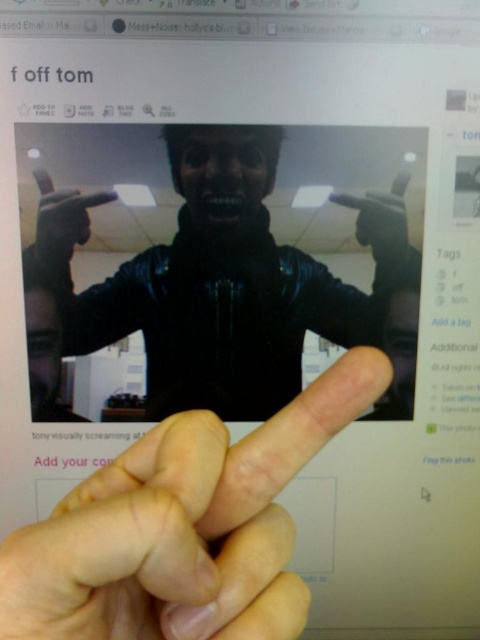
You are looking at the computer screen and see two points marked on the image. Which point is closer to you, point (396, 259) or point (374, 368)?

Point (396, 259) is closer to you because it is further to the viewer than point (374, 368).

What is the position of the black leather jacket at center in the coordinate system provided?

The black leather jacket at center is located at point (230, 284).

You are a photographer who wants to take a picture of the black leather jacket at center without the camera appearing in the shot. The camera is 21.24 inches away from the jacket. If your camera has a 12 inch wide lens, can you position it so that it doesn

The black leather jacket at center and camera are 21.24 inches apart. Since the camera lens is 12 inches wide, positioning it at least 12 inches away from the jacket would keep it out of frame. However, since they are 21.24 inches apart, there is enough space to position the camera so it doesn